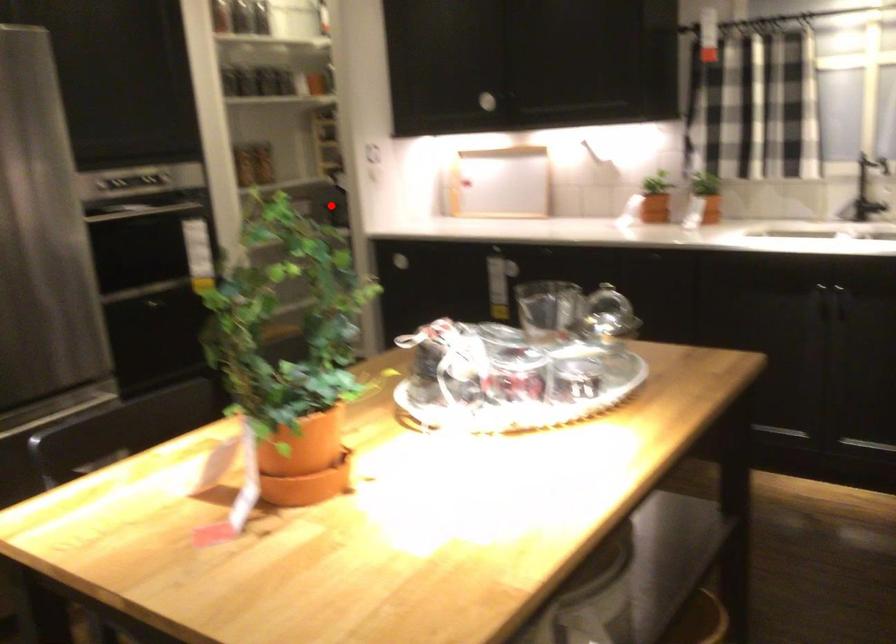
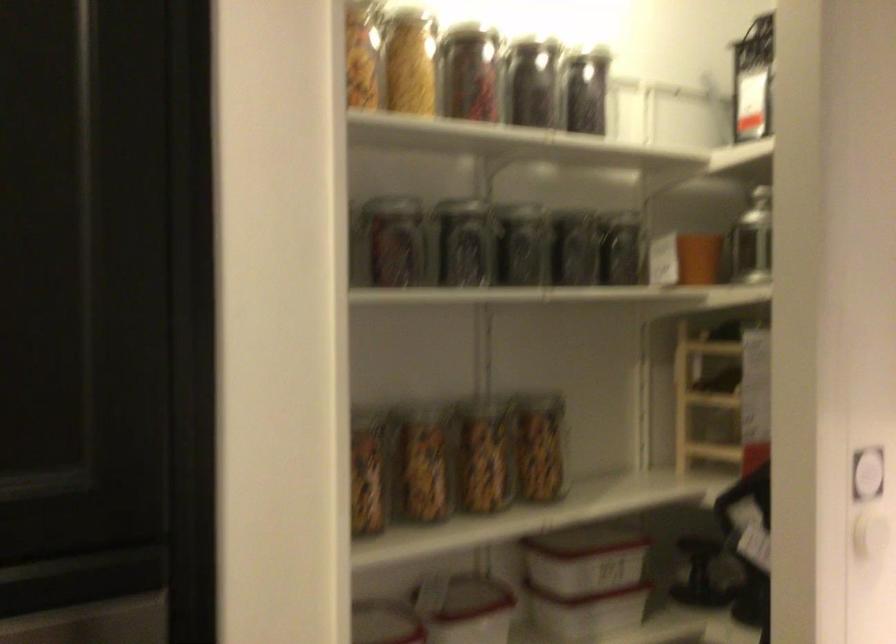
Question: A red point is marked in image1. In image2, is the corresponding 3D point closer to the camera or farther? Reply with the corresponding letter.

Choices:
 (A) The corresponding 3D point is closer.
 (B) The corresponding 3D point is farther.

Answer: (A)